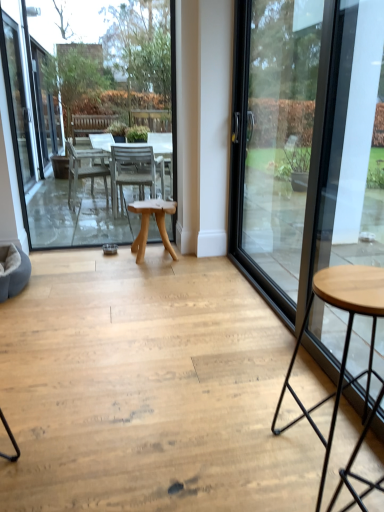
Question: From the image's perspective, does transparent glass door at right appear lower than wooden table at center?

Choices:
 (A) yes
 (B) no

Answer: (A)

Question: Does transparent glass door at right have a greater width compared to wooden table at center?

Choices:
 (A) no
 (B) yes

Answer: (B)

Question: Is transparent glass door at right aimed at wooden table at center?

Choices:
 (A) yes
 (B) no

Answer: (B)

Question: Is transparent glass door at right taller than wooden table at center?

Choices:
 (A) yes
 (B) no

Answer: (B)

Question: From a real-world perspective, is transparent glass door at right physically below wooden table at center?

Choices:
 (A) yes
 (B) no

Answer: (A)

Question: In the image, is natural wood table at center positioned in front of or behind wooden table at center?

Choices:
 (A) front
 (B) behind

Answer: (B)

Question: In terms of size, does natural wood table at center appear bigger or smaller than wooden table at center?

Choices:
 (A) big
 (B) small

Answer: (B)

Question: Considering the positions of point (168, 202) and point (168, 113), is point (168, 202) closer or farther from the camera than point (168, 113)?

Choices:
 (A) closer
 (B) farther

Answer: (A)

Question: In terms of width, does natural wood table at center look wider or thinner when compared to wooden table at center?

Choices:
 (A) wide
 (B) thin

Answer: (A)

Question: Is point (1, 36) positioned closer to the camera than point (317, 159)?

Choices:
 (A) closer
 (B) farther

Answer: (B)

Question: Is wooden table at center taller or shorter than transparent glass door at right?

Choices:
 (A) short
 (B) tall

Answer: (B)

Question: Based on their sizes in the image, would you say wooden table at center is bigger or smaller than transparent glass door at right?

Choices:
 (A) big
 (B) small

Answer: (B)

Question: Considering the relative positions of wooden table at center and transparent glass door at right in the image provided, is wooden table at center to the left or to the right of transparent glass door at right?

Choices:
 (A) left
 (B) right

Answer: (A)

Question: In the image, is wooden table at center positioned in front of or behind natural wood table at center?

Choices:
 (A) behind
 (B) front

Answer: (B)

Question: From a real-world perspective, is wooden table at center physically located above or below natural wood table at center?

Choices:
 (A) below
 (B) above

Answer: (B)